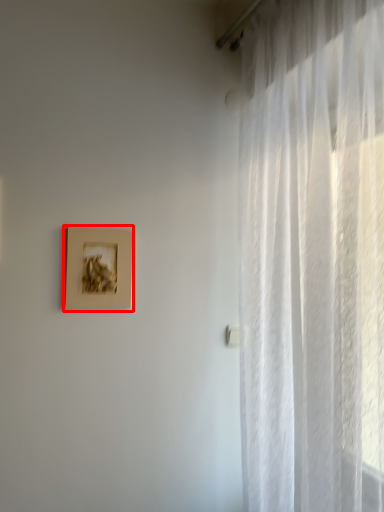
Question: In this image, where is picture frame (annotated by the red box) located relative to curtain?

Choices:
 (A) right
 (B) left

Answer: (B)